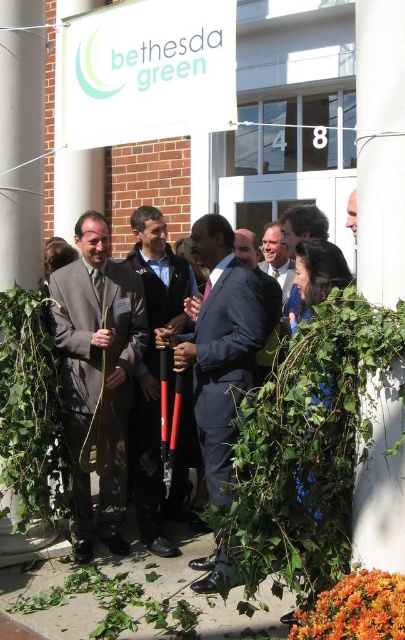
You are a photographer standing at the Bethesda Green building entrance. You want to take a photo of the navy blue suit at center and orange matte flowers at lower right so that both are in the frame. Given that your camera has a maximum focus range of 1.2 meters, will you be able to capture both subjects clearly?

The navy blue suit at center and orange matte flowers at lower right are 1.24 meters apart from each other. Since the distance between them exceeds the camera maximum focus range of 1.2 meters, you won not be able to capture both subjects clearly in the same frame.

You are a photographer at the event and need to capture a photo of the matte gray suit at center and navy blue suit at center. Which one is positioned behind the other?

The navy blue suit at center is positioned behind the matte gray suit at center.

You are a photographer trying to capture a group photo of the matte gray suit at center and the navy blue suit at center. Since you want to ensure both subjects are visible, which one should you position on the left side of the frame to match their actual positions?

The matte gray suit at center should be positioned on the left side of the frame because it is already to the left of the navy blue suit at center in the scene.